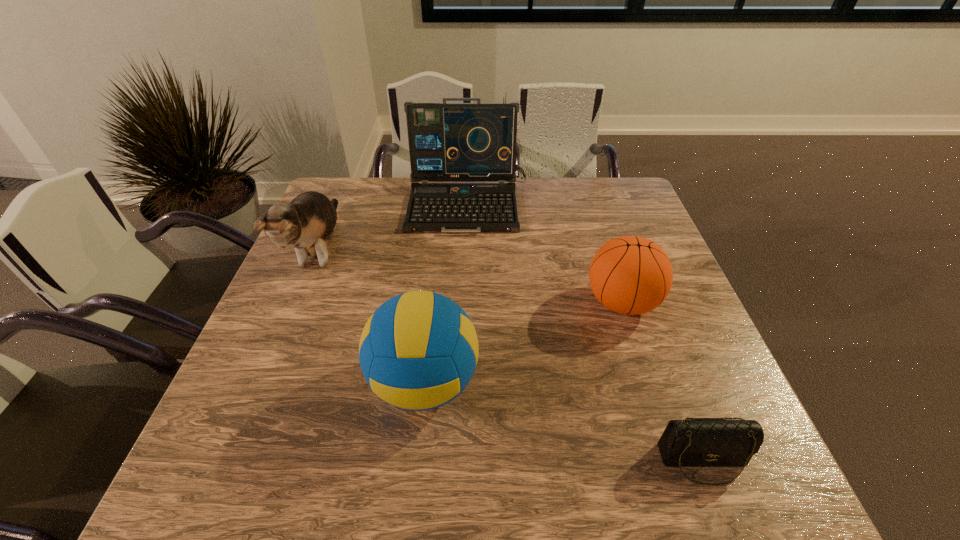
At what (x,y) coordinates should I click in order to perform the action: click on laptop computer located at the far edge. Please return your answer as a coordinate pair (x, y). Looking at the image, I should click on (448, 142).

At what (x,y) coordinates should I click in order to perform the action: click on cat that is at the far edge. Please return your answer as a coordinate pair (x, y). Image resolution: width=960 pixels, height=540 pixels. Looking at the image, I should click on (306, 223).

Locate an element on the screen. Image resolution: width=960 pixels, height=540 pixels. object that is at the near edge is located at coordinates [x=700, y=442].

Where is `object that is at the left edge`? object that is at the left edge is located at coordinates (306, 223).

You are a GUI agent. You are given a task and a screenshot of the screen. Output one action in this format:
    pyautogui.click(x=<x>, y=<y>)
    Task: Click on the basketball located in the right edge section of the desktop
    
    Given the screenshot: What is the action you would take?
    pyautogui.click(x=631, y=275)

Where is `clutch bag at the right edge`? The image size is (960, 540). clutch bag at the right edge is located at coordinates (700, 442).

At what (x,y) coordinates should I click in order to perform the action: click on object that is at the far left corner. Please return your answer as a coordinate pair (x, y). This screenshot has width=960, height=540. Looking at the image, I should click on (306, 223).

The height and width of the screenshot is (540, 960). I want to click on object that is at the near right corner, so click(700, 442).

Image resolution: width=960 pixels, height=540 pixels. What are the coordinates of `free space at the far edge` in the screenshot? It's located at (562, 195).

Where is `free space at the near edge of the desktop`? free space at the near edge of the desktop is located at coordinates (649, 455).